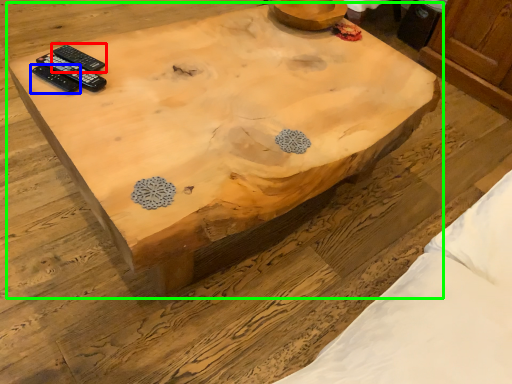
Question: Which object is positioned farthest from remote control (highlighted by a red box)? Select from remote control (highlighted by a blue box) and coffee table (highlighted by a green box).

Choices:
 (A) remote control
 (B) coffee table

Answer: (B)